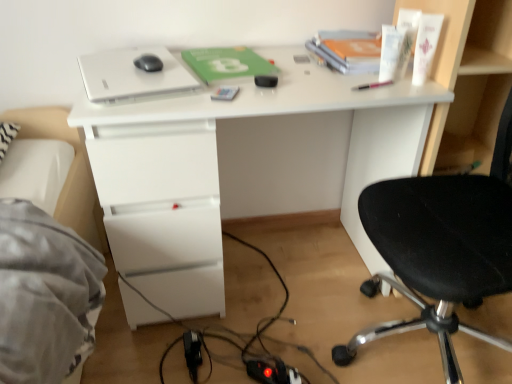
This screenshot has width=512, height=384. I want to click on empty space that is in between green matte paperback book at center and pink plastic pen at upper right, positioned as the 1th stationery in right-to-left order, so click(307, 75).